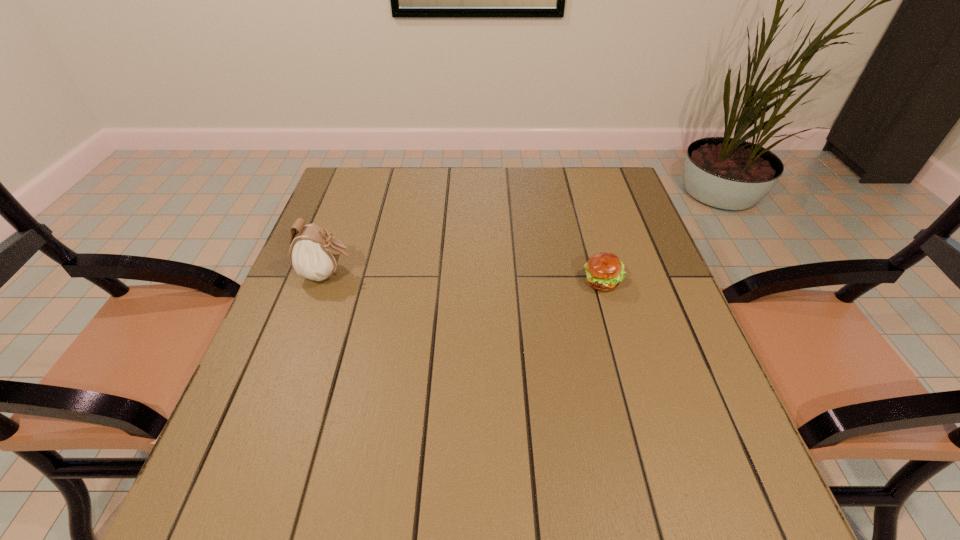
This screenshot has width=960, height=540. What are the coordinates of `the left object` in the screenshot? It's located at (313, 254).

This screenshot has width=960, height=540. In order to click on pouch in this screenshot , I will do point(313,254).

The height and width of the screenshot is (540, 960). Identify the location of the right object. (604, 271).

The image size is (960, 540). Find the location of `the shorter object`. the shorter object is located at coordinates (604, 271).

Where is `free space located 0.050m on the front-facing side of the pouch`? free space located 0.050m on the front-facing side of the pouch is located at coordinates (375, 274).

Where is `vacant space situated on the back of the right object`? vacant space situated on the back of the right object is located at coordinates (584, 217).

Locate an element on the screen. The image size is (960, 540). object present at the left edge is located at coordinates (313, 254).

I want to click on object that is at the right edge, so click(604, 271).

In the image, there is a desktop. Where is `free region at the far edge`? The width and height of the screenshot is (960, 540). free region at the far edge is located at coordinates (400, 199).

Image resolution: width=960 pixels, height=540 pixels. In order to click on blank space at the right edge in this screenshot , I will do `click(650, 282)`.